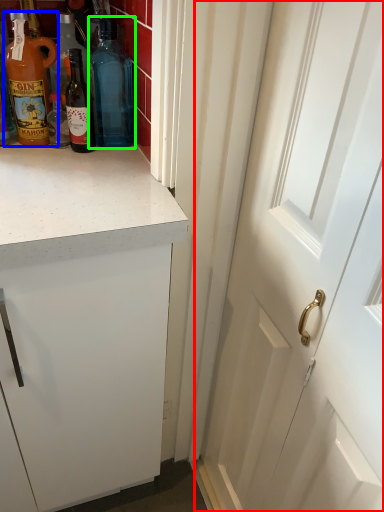
Question: Which is farther away from door (highlighted by a red box)? bottle (highlighted by a blue box) or bottle (highlighted by a green box)?

Choices:
 (A) bottle
 (B) bottle

Answer: (A)